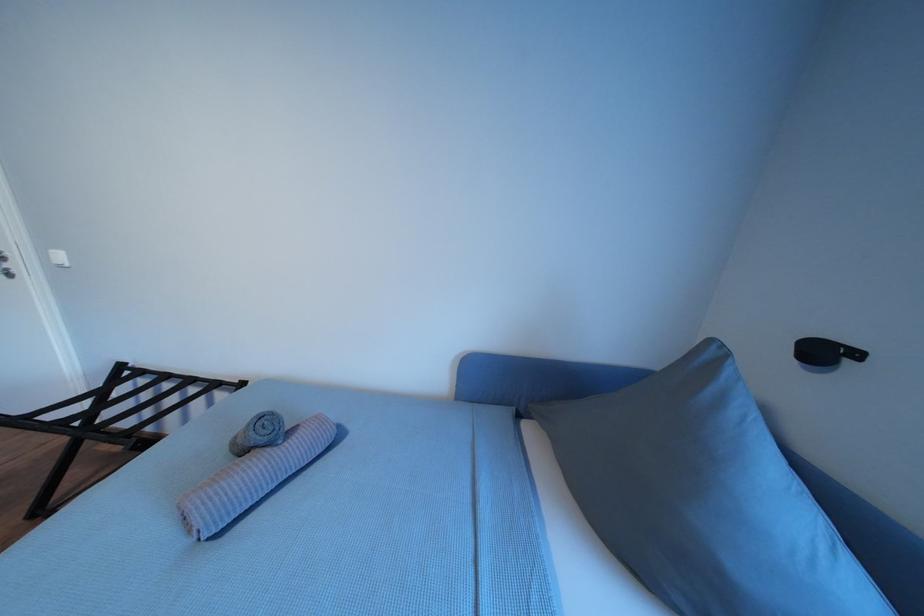
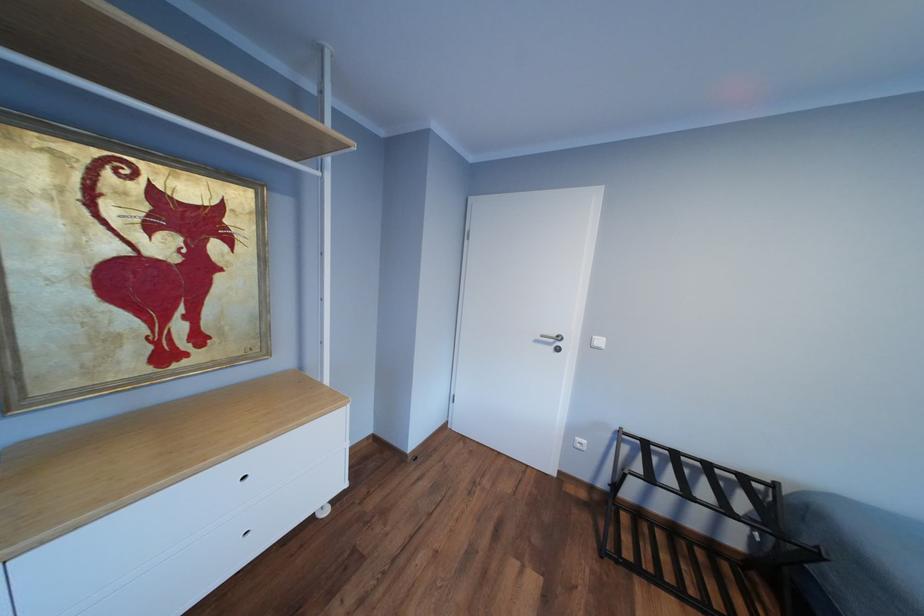
Question: In a continuous first-person perspective shot, in which direction is the camera moving?

Choices:
 (A) Left
 (B) Right
 (C) Forward
 (D) Backward

Answer: (A)